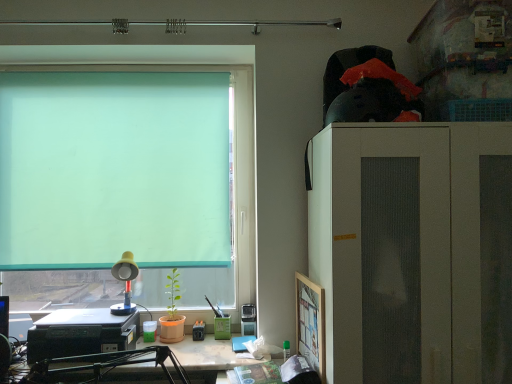
Question: Can you confirm if black plastic printer at lower left is smaller than matte black printer at lower left?

Choices:
 (A) no
 (B) yes

Answer: (A)

Question: Can you confirm if black plastic printer at lower left is shorter than matte black printer at lower left?

Choices:
 (A) no
 (B) yes

Answer: (A)

Question: From the image's perspective, is black plastic printer at lower left on matte black printer at lower left?

Choices:
 (A) yes
 (B) no

Answer: (A)

Question: Considering the relative positions of black plastic printer at lower left and matte black printer at lower left in the image provided, is black plastic printer at lower left to the left of matte black printer at lower left from the viewer's perspective?

Choices:
 (A) yes
 (B) no

Answer: (A)

Question: Is black plastic printer at lower left turned away from matte black printer at lower left?

Choices:
 (A) no
 (B) yes

Answer: (A)

Question: Is black plastic printer at lower left bigger or smaller than yellow plastic lamp at lower left?

Choices:
 (A) small
 (B) big

Answer: (B)

Question: Considering their positions, is black plastic printer at lower left located in front of or behind yellow plastic lamp at lower left?

Choices:
 (A) behind
 (B) front

Answer: (B)

Question: In terms of height, does black plastic printer at lower left look taller or shorter compared to yellow plastic lamp at lower left?

Choices:
 (A) tall
 (B) short

Answer: (B)

Question: From a real-world perspective, relative to yellow plastic lamp at lower left, is black plastic printer at lower left vertically above or below?

Choices:
 (A) above
 (B) below

Answer: (B)

Question: From a real-world perspective, is wooden picture frame at right above or below matte black printer at lower left?

Choices:
 (A) above
 (B) below

Answer: (A)

Question: In terms of size, does wooden picture frame at right appear bigger or smaller than matte black printer at lower left?

Choices:
 (A) big
 (B) small

Answer: (B)

Question: Considering their positions, is wooden picture frame at right located in front of or behind matte black printer at lower left?

Choices:
 (A) behind
 (B) front

Answer: (B)

Question: Considering the positions of point (307, 357) and point (237, 360), is point (307, 357) closer or farther from the camera than point (237, 360)?

Choices:
 (A) farther
 (B) closer

Answer: (B)

Question: Considering the positions of point tap(236, 362) and point tap(247, 264), is point tap(236, 362) closer or farther from the camera than point tap(247, 264)?

Choices:
 (A) closer
 (B) farther

Answer: (A)

Question: Is matte black printer at lower left in front of or behind green translucent roller at upper left in the image?

Choices:
 (A) behind
 (B) front

Answer: (B)